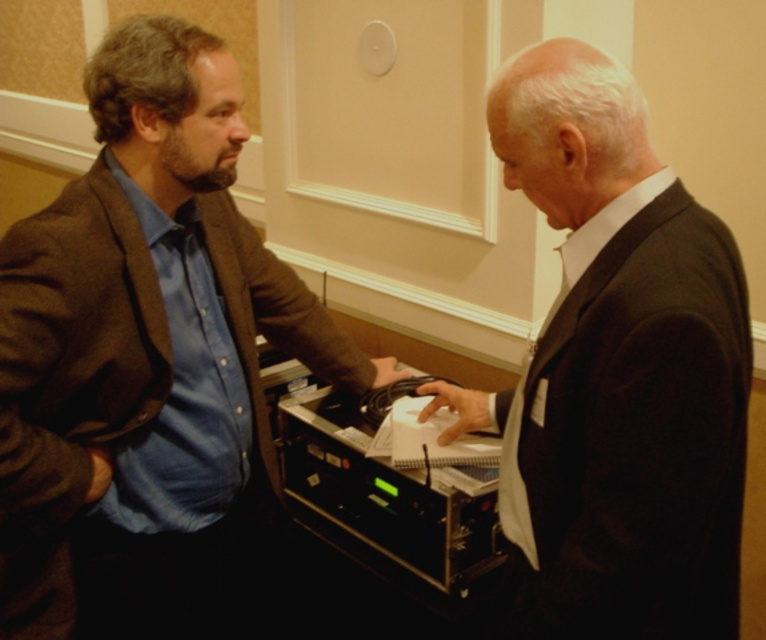
Question: Which point appears farthest from the camera in this image?

Choices:
 (A) (715, 308)
 (B) (97, 428)

Answer: (B)

Question: Among these points, which one is nearest to the camera?

Choices:
 (A) (87, 467)
 (B) (597, 396)

Answer: (B)

Question: From the image, what is the correct spatial relationship of brown woolen jacket at left in relation to dark suit at right?

Choices:
 (A) left
 (B) right

Answer: (A)

Question: Where is brown woolen jacket at left located in relation to dark suit at right in the image?

Choices:
 (A) below
 (B) above

Answer: (A)

Question: Does brown woolen jacket at left have a lesser width compared to dark suit at right?

Choices:
 (A) no
 (B) yes

Answer: (A)

Question: Which point is closer to the camera?

Choices:
 (A) brown woolen jacket at left
 (B) dark suit at right

Answer: (B)